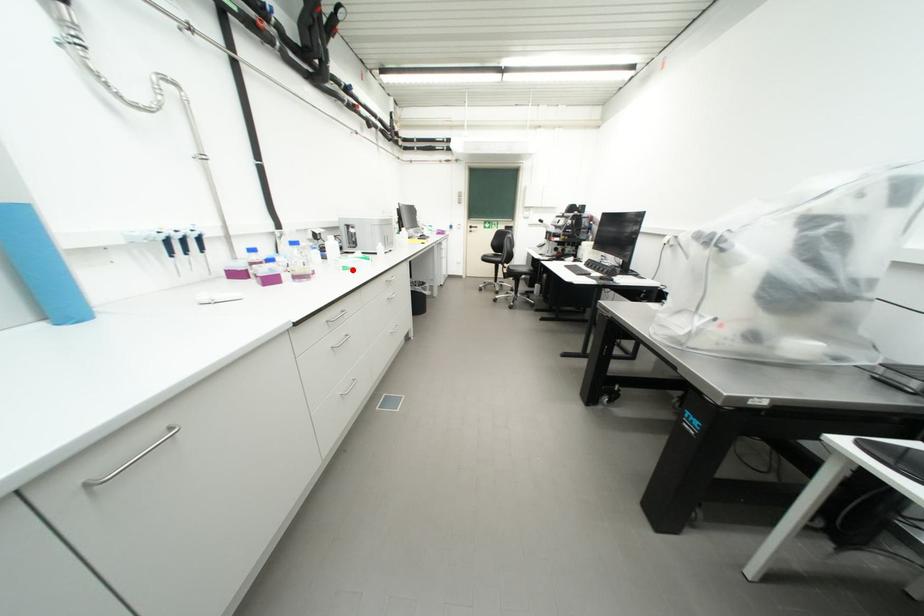
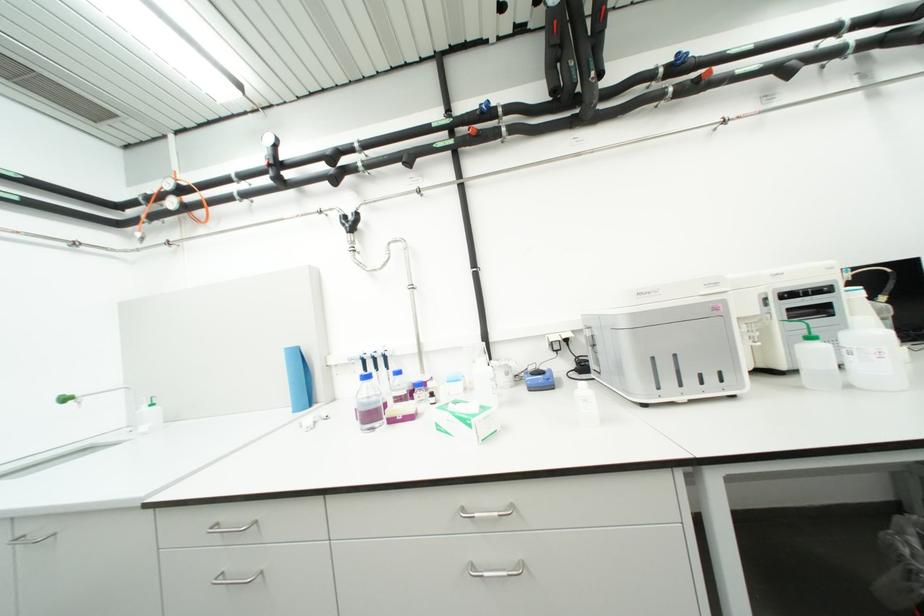
Find the pixel in the second image that matches the highlighted location in the first image.

(446, 429)